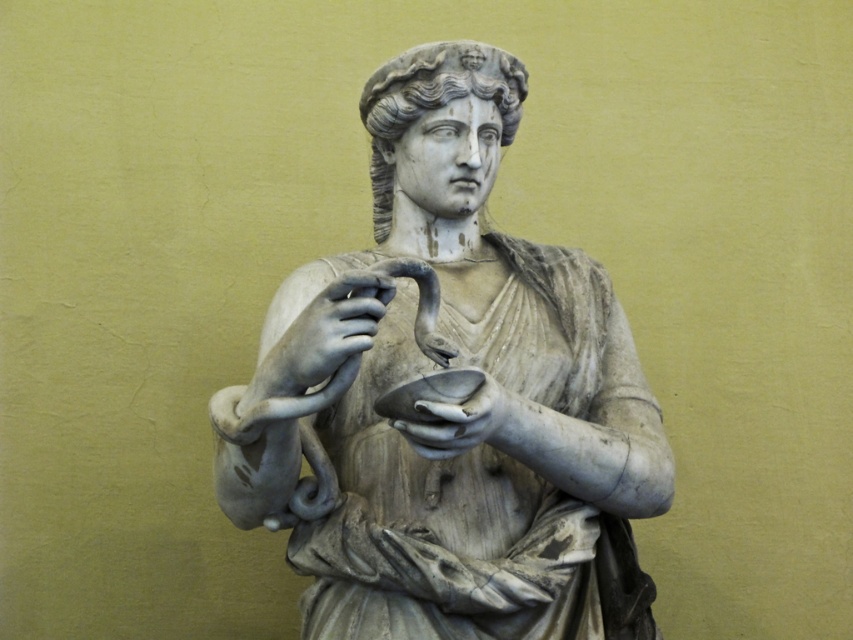
Question: Can you confirm if white marble statue at center is positioned below white marble snake at center?

Choices:
 (A) yes
 (B) no

Answer: (A)

Question: Is white marble snake at center further to camera compared to white marble hand at center?

Choices:
 (A) yes
 (B) no

Answer: (B)

Question: Which of these objects is positioned closest to the white marble hand at center?

Choices:
 (A) white marble snake at center
 (B) white marble statue at center

Answer: (A)

Question: Which point is closer to the camera?

Choices:
 (A) white marble hand at center
 (B) white marble statue at center

Answer: (B)

Question: In this image, where is white marble statue at center located relative to white marble snake at center?

Choices:
 (A) below
 (B) above

Answer: (A)

Question: Which object is farther from the camera taking this photo?

Choices:
 (A) white marble hand at center
 (B) white marble snake at center
 (C) white marble statue at center

Answer: (A)